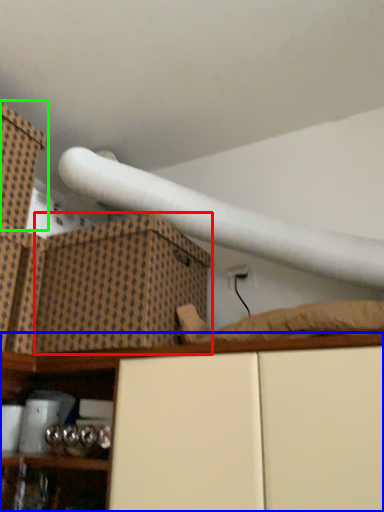
Question: Based on their relative distances, which object is nearer to cardboard box (highlighted by a red box)? Choose from shelf (highlighted by a blue box) and box (highlighted by a green box).

Choices:
 (A) shelf
 (B) box

Answer: (A)